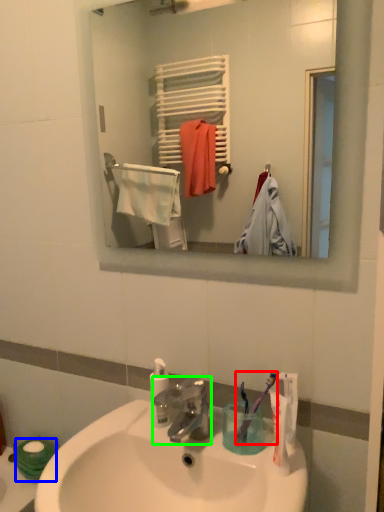
Question: Which object is positioned closest to toothbrush (highlighted by a red box)? Select from toilet paper (highlighted by a blue box) and tap (highlighted by a green box).

Choices:
 (A) toilet paper
 (B) tap

Answer: (B)